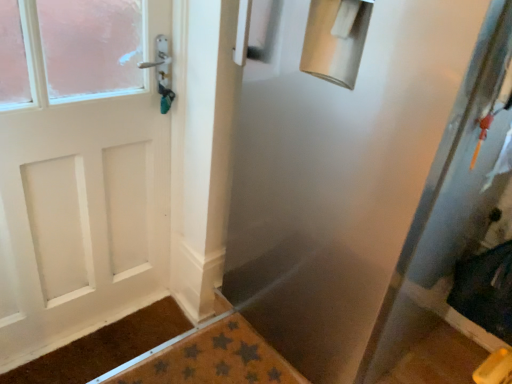
What are the coordinates of `transparent plastic screen door at center` in the screenshot? It's located at (343, 184).

The image size is (512, 384). What are the coordinates of `transparent plastic screen door at center` in the screenshot? It's located at (343, 184).

Is brown textured mat at lower left looking in the opposite direction of brown textured bath mat at lower center?

No, brown textured mat at lower left's orientation is not away from brown textured bath mat at lower center.

Image resolution: width=512 pixels, height=384 pixels. I want to click on doormat located above the brown textured bath mat at lower center (from the image's perspective), so click(x=104, y=347).

Is brown textured bath mat at lower center surrounded by brown textured mat at lower left?

No, brown textured mat at lower left does not contain brown textured bath mat at lower center.

Is brown textured mat at lower left smaller than brown textured bath mat at lower center?

Correct, brown textured mat at lower left occupies less space than brown textured bath mat at lower center.

In the scene shown: From a real-world perspective, is transparent plastic screen door at center physically above brown textured bath mat at lower center?

Yes, from a real-world perspective, transparent plastic screen door at center is above brown textured bath mat at lower center.

Consider the image. Does transparent plastic screen door at center lie in front of brown textured bath mat at lower center?

Yes, it is.

In order to click on bath mat on the left of transparent plastic screen door at center in this screenshot , I will do `click(210, 358)`.

Considering the relative sizes of transparent plastic screen door at center and brown textured bath mat at lower center in the image provided, is transparent plastic screen door at center shorter than brown textured bath mat at lower center?

No, transparent plastic screen door at center is not shorter than brown textured bath mat at lower center.

Does brown textured bath mat at lower center turn towards brown textured mat at lower left?

No, brown textured bath mat at lower center is not turned towards brown textured mat at lower left.

Where is `bath mat on the right side of brown textured mat at lower left`? This screenshot has width=512, height=384. bath mat on the right side of brown textured mat at lower left is located at coordinates (210, 358).

From the image's perspective, is brown textured bath mat at lower center located above or below brown textured mat at lower left?

brown textured bath mat at lower center is below brown textured mat at lower left.

Is transparent plastic screen door at center turned away from brown textured mat at lower left?

No, transparent plastic screen door at center is not facing the opposite direction of brown textured mat at lower left.

Find the location of `doormat beneath the transparent plastic screen door at center (from a real-world perspective)`. doormat beneath the transparent plastic screen door at center (from a real-world perspective) is located at coordinates (104, 347).

Is transparent plastic screen door at center not near brown textured mat at lower left?

No.

Looking at the image, does transparent plastic screen door at center seem bigger or smaller compared to brown textured mat at lower left?

Considering their sizes, transparent plastic screen door at center takes up more space than brown textured mat at lower left.

From the picture: Is brown textured bath mat at lower center positioned far away from transparent plastic screen door at center?

No, brown textured bath mat at lower center is not far away from transparent plastic screen door at center.

Considering the sizes of objects brown textured bath mat at lower center and transparent plastic screen door at center in the image provided, who is smaller, brown textured bath mat at lower center or transparent plastic screen door at center?

Smaller between the two is brown textured bath mat at lower center.

Which of these two, brown textured bath mat at lower center or transparent plastic screen door at center, stands taller?

transparent plastic screen door at center.

Looking at this image, from a real-world perspective, is brown textured bath mat at lower center physically located above or below transparent plastic screen door at center?

brown textured bath mat at lower center is situated lower than transparent plastic screen door at center in the real world.

Is brown textured mat at lower left placed right next to transparent plastic screen door at center?

No, brown textured mat at lower left is not with transparent plastic screen door at center.

Considering the positions of objects brown textured mat at lower left and transparent plastic screen door at center in the image provided, who is more to the left, brown textured mat at lower left or transparent plastic screen door at center?

Positioned to the left is brown textured mat at lower left.

Does brown textured mat at lower left have a greater height compared to transparent plastic screen door at center?

No.

Considering the sizes of brown textured mat at lower left and transparent plastic screen door at center in the image, is brown textured mat at lower left wider or thinner than transparent plastic screen door at center?

brown textured mat at lower left is thinner than transparent plastic screen door at center.

Identify the location of doormat behind the brown textured bath mat at lower center. The height and width of the screenshot is (384, 512). (104, 347).

This screenshot has height=384, width=512. Identify the location of bath mat below the transparent plastic screen door at center (from a real-world perspective). (210, 358).

From the image, which object appears to be nearer to brown textured bath mat at lower center, brown textured mat at lower left or transparent plastic screen door at center?

Based on the image, brown textured mat at lower left appears to be nearer to brown textured bath mat at lower center.

Estimate the real-world distances between objects in this image. Which object is further from transparent plastic screen door at center, brown textured bath mat at lower center or brown textured mat at lower left?

brown textured mat at lower left.

When comparing their distances from brown textured mat at lower left, does transparent plastic screen door at center or brown textured bath mat at lower center seem closer?

brown textured bath mat at lower center.

When comparing their distances from brown textured mat at lower left, does brown textured bath mat at lower center or transparent plastic screen door at center seem closer?

brown textured bath mat at lower center is closer to brown textured mat at lower left.

When comparing their distances from transparent plastic screen door at center, does brown textured mat at lower left or brown textured bath mat at lower center seem further?

brown textured mat at lower left is further to transparent plastic screen door at center.

Based on their spatial positions, is transparent plastic screen door at center or brown textured mat at lower left further from brown textured bath mat at lower center?

Based on the image, transparent plastic screen door at center appears to be further to brown textured bath mat at lower center.

Identify the location of bath mat situated between brown textured mat at lower left and transparent plastic screen door at center from left to right. This screenshot has width=512, height=384. click(210, 358).